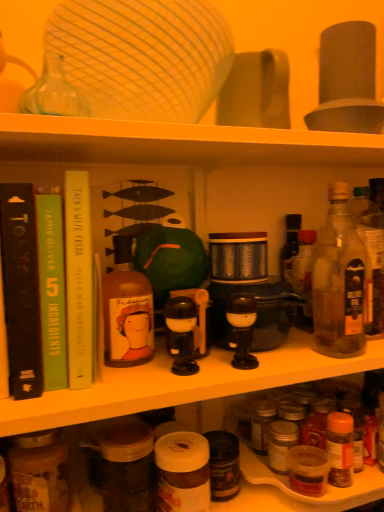
Where is `free space to the left of black plastic toy at center`? The height and width of the screenshot is (512, 384). free space to the left of black plastic toy at center is located at coordinates (99, 381).